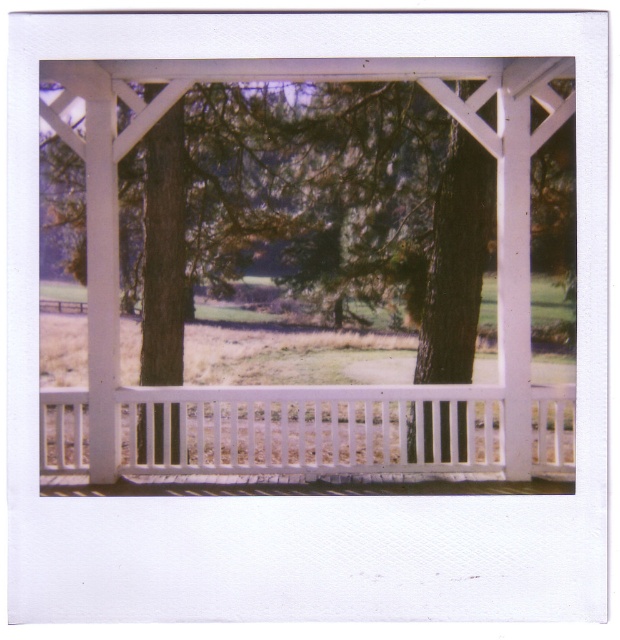
Between white painted wood pergola at center and white wooden railing at center, which one has more height?

With more height is white painted wood pergola at center.

Can you confirm if white painted wood pergola at center is bigger than white wooden railing at center?

Yes.

Between point (113, 88) and point (513, 474), which one is positioned behind?

The point (513, 474) is more distant.

Find the location of a particular element. This screenshot has height=640, width=620. white painted wood pergola at center is located at coordinates (306, 387).